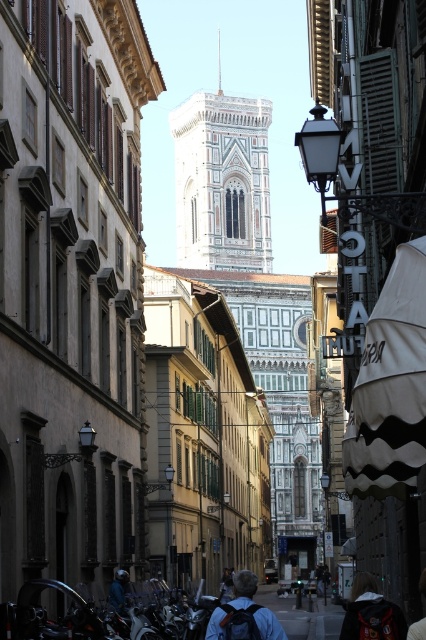
Question: Which is farther from the white marble tower at center?

Choices:
 (A) blue denim jeans at lower center
 (B) dark gray hoodie at lower center
 (C) white striped fabric umbrella at center-right
 (D) dark blue backpack at center

Answer: (B)

Question: Which of these objects is positioned farthest from the dark gray hoodie at lower center?

Choices:
 (A) white striped fabric umbrella at center-right
 (B) dark blue backpack at center

Answer: (A)

Question: Is the position of dark gray hoodie at lower center more distant than that of blue denim jeans at lower center?

Choices:
 (A) no
 (B) yes

Answer: (A)

Question: Does white marble tower at center come behind blue denim jeans at lower center?

Choices:
 (A) yes
 (B) no

Answer: (A)

Question: Among these points, which one is nearest to the camera?

Choices:
 (A) (262, 113)
 (B) (253, 611)

Answer: (B)

Question: Is dark gray hoodie at lower center positioned before blue denim jeans at lower center?

Choices:
 (A) yes
 (B) no

Answer: (A)